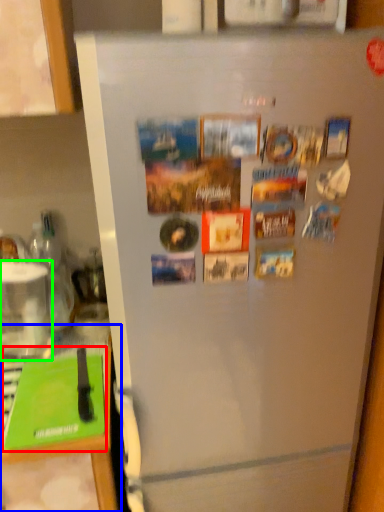
Question: Based on their relative distances, which object is farther from magazine (highlighted by a red box)? Choose from counter top (highlighted by a blue box) and appliance (highlighted by a green box).

Choices:
 (A) counter top
 (B) appliance

Answer: (B)